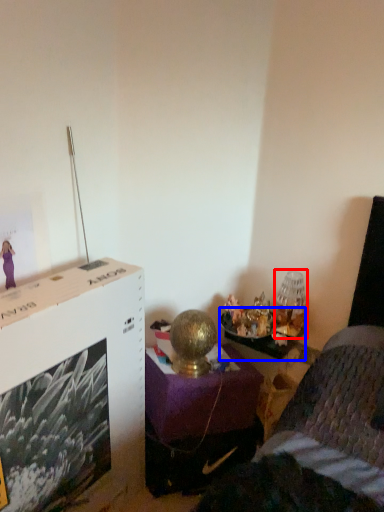
Question: Which object appears closest to the camera in this image, table lamp (highlighted by a red box) or table (highlighted by a blue box)?

Choices:
 (A) table lamp
 (B) table

Answer: (B)